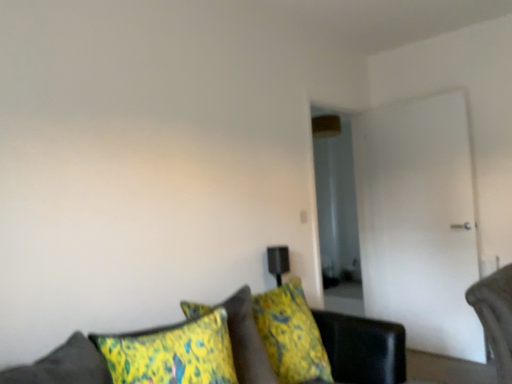
Question: Is velvet green couch at lower center bigger than white glossy door at right?

Choices:
 (A) yes
 (B) no

Answer: (A)

Question: Is velvet green couch at lower center at the right side of white glossy door at right?

Choices:
 (A) no
 (B) yes

Answer: (A)

Question: From a real-world perspective, is velvet green couch at lower center on white glossy door at right?

Choices:
 (A) no
 (B) yes

Answer: (A)

Question: Is velvet green couch at lower center facing away from white glossy door at right?

Choices:
 (A) yes
 (B) no

Answer: (B)

Question: Is velvet green couch at lower center positioned beyond the bounds of white glossy door at right?

Choices:
 (A) yes
 (B) no

Answer: (A)

Question: Considering the positions of point (430, 172) and point (229, 340), is point (430, 172) closer or farther from the camera than point (229, 340)?

Choices:
 (A) closer
 (B) farther

Answer: (B)

Question: Considering the positions of white glossy door at right and yellow-green fabric pillow at lower center in the image, is white glossy door at right taller or shorter than yellow-green fabric pillow at lower center?

Choices:
 (A) tall
 (B) short

Answer: (A)

Question: From a real-world perspective, relative to yellow-green fabric pillow at lower center, is white glossy door at right vertically above or below?

Choices:
 (A) below
 (B) above

Answer: (B)

Question: From the image's perspective, relative to yellow-green fabric pillow at lower center, is white glossy door at right above or below?

Choices:
 (A) above
 (B) below

Answer: (A)

Question: Choose the correct answer: Is velvet green couch at lower center inside white glossy door at right or outside it?

Choices:
 (A) outside
 (B) inside

Answer: (A)

Question: Is velvet green couch at lower center taller or shorter than white glossy door at right?

Choices:
 (A) short
 (B) tall

Answer: (A)

Question: Relative to white glossy door at right, is velvet green couch at lower center in front or behind?

Choices:
 (A) front
 (B) behind

Answer: (A)

Question: Looking at their shapes, would you say velvet green couch at lower center is wider or thinner than white glossy door at right?

Choices:
 (A) wide
 (B) thin

Answer: (A)

Question: Looking at their shapes, would you say velvet green couch at lower center is wider or thinner than yellow-green fabric pillow at lower center?

Choices:
 (A) thin
 (B) wide

Answer: (B)

Question: From a real-world perspective, is velvet green couch at lower center positioned above or below yellow-green fabric pillow at lower center?

Choices:
 (A) above
 (B) below

Answer: (B)